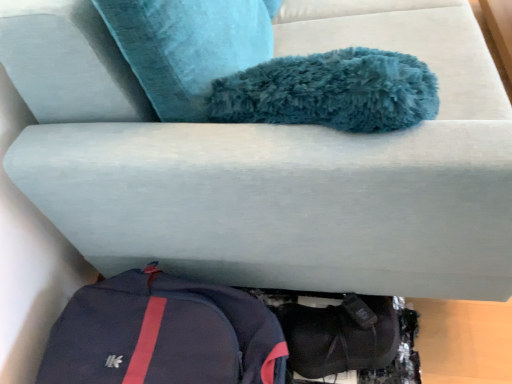
Question: Considering the relative sizes of black fabric shoe at lower center and navy blue fabric backpack at lower left in the image provided, is black fabric shoe at lower center thinner than navy blue fabric backpack at lower left?

Choices:
 (A) yes
 (B) no

Answer: (A)

Question: From the image's perspective, is black fabric shoe at lower center below navy blue fabric backpack at lower left?

Choices:
 (A) yes
 (B) no

Answer: (A)

Question: Is black fabric shoe at lower center behind navy blue fabric backpack at lower left?

Choices:
 (A) yes
 (B) no

Answer: (A)

Question: From a real-world perspective, is black fabric shoe at lower center over navy blue fabric backpack at lower left?

Choices:
 (A) no
 (B) yes

Answer: (A)

Question: Is black fabric shoe at lower center far from navy blue fabric backpack at lower left?

Choices:
 (A) yes
 (B) no

Answer: (B)

Question: Is black fabric shoe at lower center completely or partially outside of navy blue fabric backpack at lower left?

Choices:
 (A) no
 (B) yes

Answer: (B)

Question: Can you confirm if navy blue fabric backpack at lower left is shorter than black fabric shoe at lower center?

Choices:
 (A) yes
 (B) no

Answer: (B)

Question: Can you confirm if navy blue fabric backpack at lower left is smaller than black fabric shoe at lower center?

Choices:
 (A) yes
 (B) no

Answer: (B)

Question: Does navy blue fabric backpack at lower left have a greater width compared to black fabric shoe at lower center?

Choices:
 (A) yes
 (B) no

Answer: (A)

Question: Is navy blue fabric backpack at lower left not near black fabric shoe at lower center?

Choices:
 (A) no
 (B) yes

Answer: (A)

Question: From a real-world perspective, is navy blue fabric backpack at lower left physically above black fabric shoe at lower center?

Choices:
 (A) yes
 (B) no

Answer: (A)

Question: Is navy blue fabric backpack at lower left looking in the opposite direction of black fabric shoe at lower center?

Choices:
 (A) no
 (B) yes

Answer: (A)

Question: Considering the positions of navy blue fabric backpack at lower left and black fabric shoe at lower center in the image, is navy blue fabric backpack at lower left bigger or smaller than black fabric shoe at lower center?

Choices:
 (A) small
 (B) big

Answer: (B)